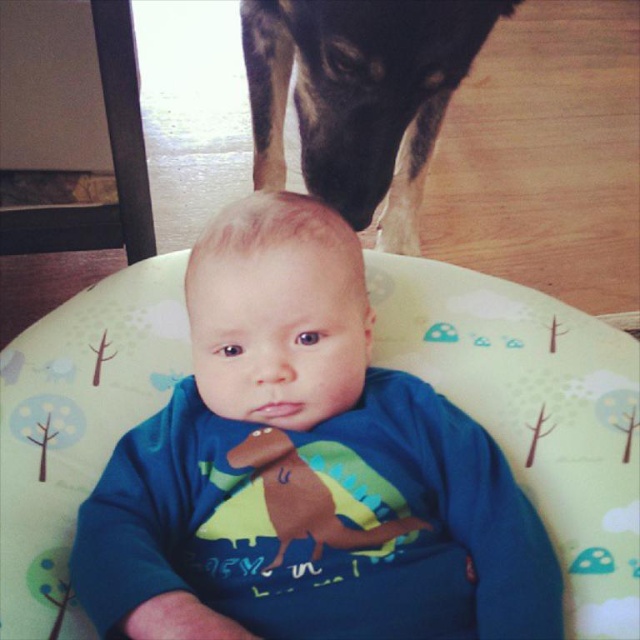
Question: Which of the following is the farthest from the observer?

Choices:
 (A) pyautogui.click(x=320, y=356)
 (B) pyautogui.click(x=445, y=3)

Answer: (B)

Question: Can you confirm if blue soft baby at center is positioned to the left of black fur dog at upper center?

Choices:
 (A) yes
 (B) no

Answer: (A)

Question: Is blue soft baby at center below black fur dog at upper center?

Choices:
 (A) no
 (B) yes

Answer: (B)

Question: Can you confirm if blue soft baby at center is positioned above black fur dog at upper center?

Choices:
 (A) no
 (B) yes

Answer: (A)

Question: Among these objects, which one is nearest to the camera?

Choices:
 (A) black fur dog at upper center
 (B) blue soft baby at center

Answer: (B)

Question: Among these objects, which one is nearest to the camera?

Choices:
 (A) black fur dog at upper center
 (B) blue soft baby at center

Answer: (B)